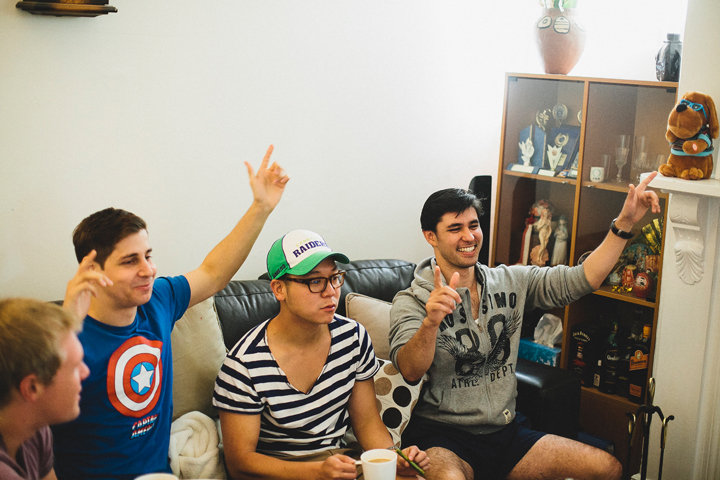
In order to click on wall in this screenshot , I will do `click(202, 79)`, `click(651, 15)`.